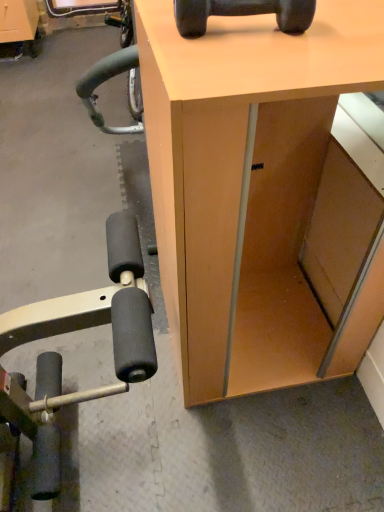
Question: Is matte wood desk at center bigger or smaller than black rubber dumbbell at upper center?

Choices:
 (A) big
 (B) small

Answer: (A)

Question: From the image's perspective, is matte wood desk at center above or below black rubber dumbbell at upper center?

Choices:
 (A) above
 (B) below

Answer: (B)

Question: Based on their positions, is matte wood desk at center located to the left or right of black rubber dumbbell at upper center?

Choices:
 (A) left
 (B) right

Answer: (B)

Question: Considering their positions, is black rubber dumbbell at upper center located in front of or behind matte wood desk at center?

Choices:
 (A) behind
 (B) front

Answer: (A)

Question: Considering the positions of black rubber dumbbell at upper center and matte wood desk at center in the image, is black rubber dumbbell at upper center bigger or smaller than matte wood desk at center?

Choices:
 (A) big
 (B) small

Answer: (B)

Question: Is black rubber dumbbell at upper center situated inside matte wood desk at center or outside?

Choices:
 (A) outside
 (B) inside

Answer: (A)

Question: Is black rubber dumbbell at upper center wider or thinner than matte wood desk at center?

Choices:
 (A) wide
 (B) thin

Answer: (B)